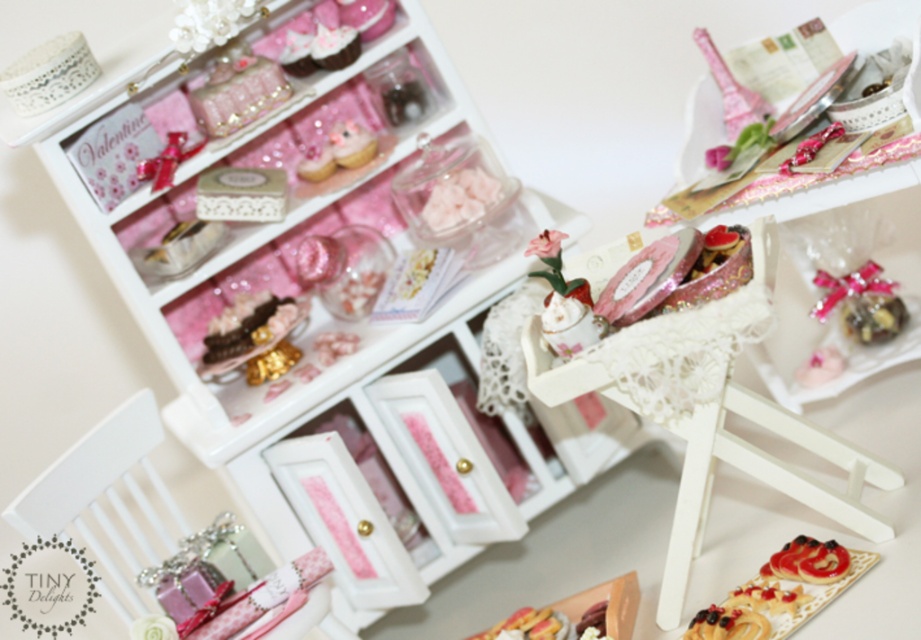
Is point (207, 346) closer to camera compared to point (844, 561)?

No, (207, 346) is behind (844, 561).

Does chocolate cake at center have a lesser width compared to glazed pastry at center?

No, chocolate cake at center is not thinner than glazed pastry at center.

Is point (216, 330) farther from viewer compared to point (830, 576)?

Yes, it is behind point (830, 576).

Locate an element on the screen. The width and height of the screenshot is (921, 640). chocolate cake at center is located at coordinates (243, 324).

Who is higher up, shiny gold necklace at upper left or glazed pastry at center?

shiny gold necklace at upper left

Is shiny gold necklace at upper left below glazed pastry at center?

No, shiny gold necklace at upper left is not below glazed pastry at center.

Is point (234, 115) positioned after point (780, 557)?

That is True.

Locate an element on the screen. This screenshot has width=921, height=640. shiny gold necklace at upper left is located at coordinates (239, 93).

Does shiny gold necklace at upper left lie behind chocolate cake at center?

That is False.

Is point (237, 72) closer to camera compared to point (265, 300)?

Yes, it is in front of point (265, 300).

Locate an element on the screen. Image resolution: width=921 pixels, height=640 pixels. shiny gold necklace at upper left is located at coordinates (239, 93).